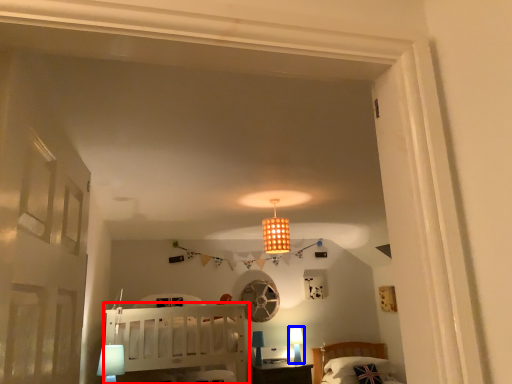
Question: Which point is further to the camera, furniture (highlighted by a red box) or table lamp (highlighted by a blue box)?

Choices:
 (A) furniture
 (B) table lamp

Answer: (B)